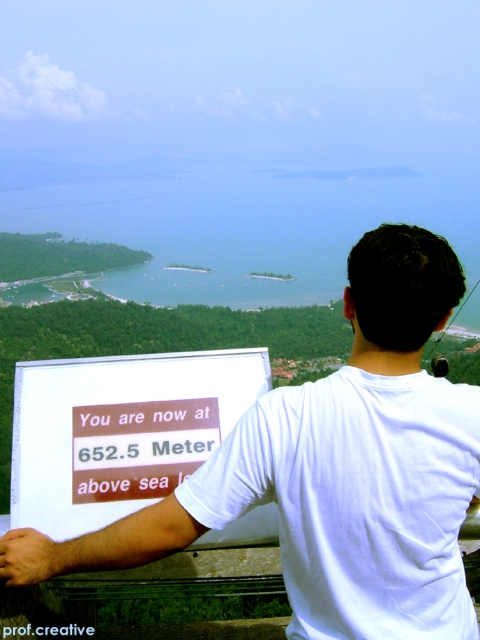
You are standing at the point marked by the person in the image. You want to take a photo of the landscape. If you look towards the point at coordinates point (358, 573) and point (148, 419), which point is closer to your camera lens?

Point (358, 573) is closer to the camera than point (148, 419).

You are standing at the scenic overlook and want to take a photo of the white cotton shirt at center and the white paper sign at center. Which object should you focus on first if you want to capture both in the same frame without moving the camera?

The white cotton shirt at center is located above the white paper sign at center, so you should focus on the white paper sign at center first to ensure both are in the frame.